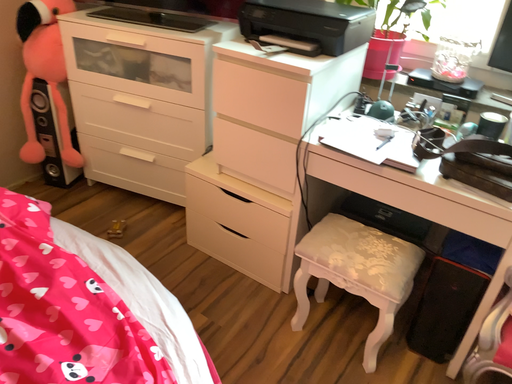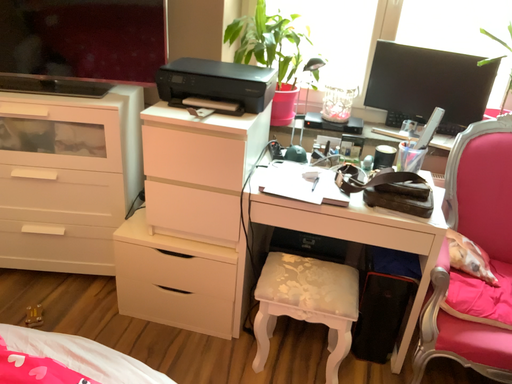
Question: Which way did the camera rotate in the video?

Choices:
 (A) rotated downward
 (B) rotated upward

Answer: (B)